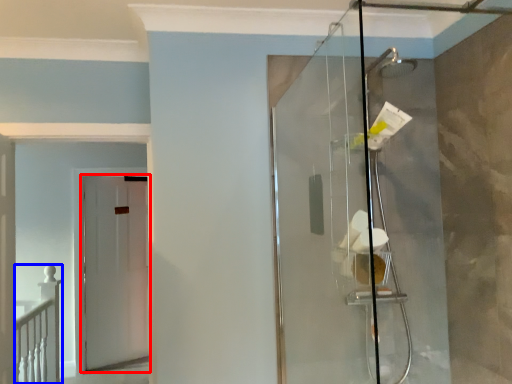
Question: Which object is further to the camera taking this photo, door (highlighted by a red box) or rail (highlighted by a blue box)?

Choices:
 (A) door
 (B) rail

Answer: (A)